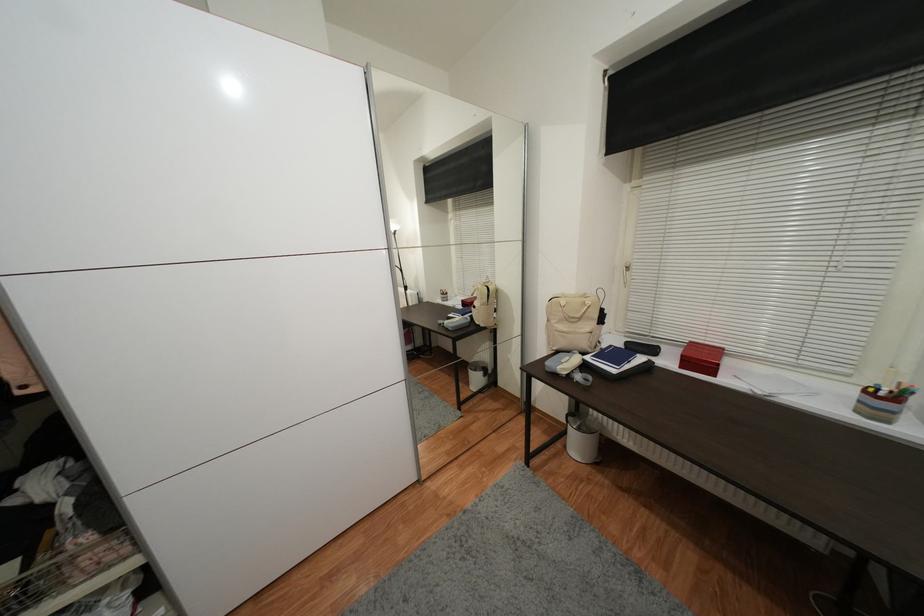
I want to click on striped pencil holder, so click(882, 400).